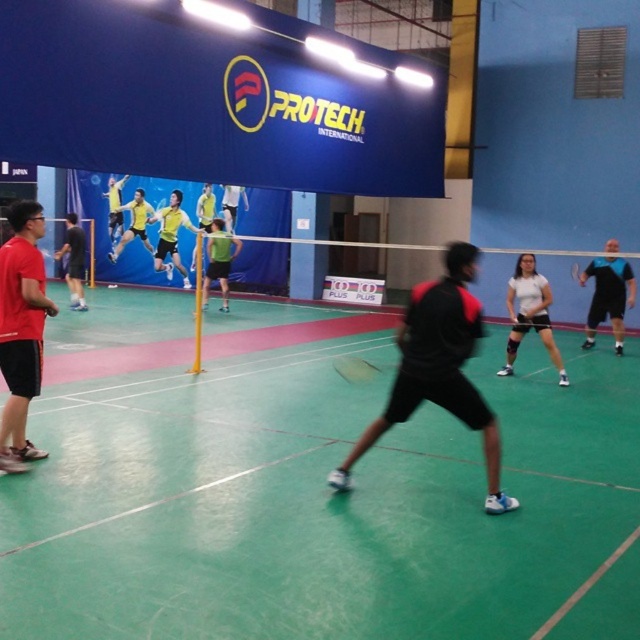
Question: Observing the image, what is the correct spatial positioning of green matte shirt at center in reference to black rubber racket at center?

Choices:
 (A) right
 (B) left

Answer: (B)

Question: Which of the following is the closest to the observer?

Choices:
 (A) black matte jacket at center
 (B) yellow jersey at center

Answer: (A)

Question: Which object is positioned closest to the yellow-green shirt at center?

Choices:
 (A) yellow-green shirt at upper left
 (B) matte black shorts at left

Answer: (A)

Question: Does black matte shorts at right lie in front of yellow jersey at center?

Choices:
 (A) yes
 (B) no

Answer: (A)

Question: Which is nearer to the black matte jacket at center?

Choices:
 (A) yellow shirt at upper left
 (B) black matte shorts at right
 (C) black rubber racket at center

Answer: (C)

Question: Is the position of black matte shorts at right more distant than that of green fabric shorts at center?

Choices:
 (A) yes
 (B) no

Answer: (B)